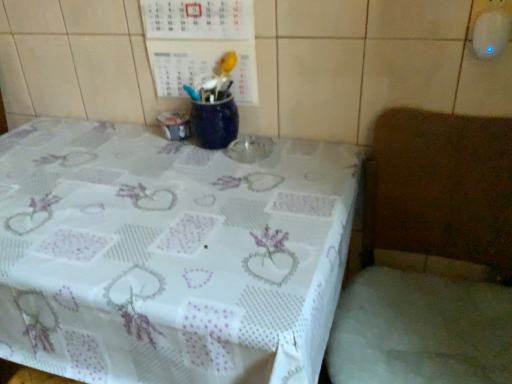
This screenshot has height=384, width=512. Find the location of `wooden chair at right`. wooden chair at right is located at coordinates tap(431, 256).

Describe the element at coordinates (420, 330) in the screenshot. I see `white lace tablecloth at lower right` at that location.

In order to face white lace tablecloth at lower right, should I rotate leftwards or rightwards?

A 21.931 degree turn to the right will do.

This screenshot has height=384, width=512. In order to click on wooden chair at right in this screenshot , I will do `click(431, 256)`.

Is wooden chair at right aimed at white lace tablecloth at center?

No, wooden chair at right does not turn towards white lace tablecloth at center.

How different are the orientations of wooden chair at right and white lace tablecloth at center in degrees?

0.288 degrees separate the facing orientations of wooden chair at right and white lace tablecloth at center.

Does point (375, 153) appear closer or farther from the camera than point (298, 187)?

Clearly, point (375, 153) is more distant from the camera than point (298, 187).

Considering the relative sizes of wooden chair at right and white lace tablecloth at center in the image provided, is wooden chair at right bigger than white lace tablecloth at center?

Actually, wooden chair at right might be smaller than white lace tablecloth at center.

Is there a large distance between white lace tablecloth at center and white lace tablecloth at lower right?

They are positioned close to each other.

Could you tell me if white lace tablecloth at center is turned towards white lace tablecloth at lower right?

No, white lace tablecloth at center does not turn towards white lace tablecloth at lower right.

From a real-world perspective, is white lace tablecloth at center on top of white lace tablecloth at lower right?

Incorrect, from a real-world perspective, white lace tablecloth at center is lower than white lace tablecloth at lower right.

Where is `table below the white lace tablecloth at lower right (from the image's perspective)`? The height and width of the screenshot is (384, 512). table below the white lace tablecloth at lower right (from the image's perspective) is located at coordinates (169, 255).

Between white lace tablecloth at center and wooden chair at right, which one is positioned in front?

wooden chair at right is closer to the camera.

Considering the positions of objects white lace tablecloth at center and wooden chair at right in the image provided, who is more to the left, white lace tablecloth at center or wooden chair at right?

Positioned to the left is white lace tablecloth at center.

Is white lace tablecloth at center not close to wooden chair at right?

They are positioned close to each other.

Which is behind, point (316, 197) or point (443, 262)?

The point (443, 262) is farther from the camera.

Locate an element on the screen. Image resolution: width=512 pixels, height=384 pixels. table lying in front of the white lace tablecloth at lower right is located at coordinates (169, 255).

Is white lace tablecloth at lower right taller than white lace tablecloth at center?

No.

Is white lace tablecloth at lower right oriented away from white lace tablecloth at center?

No, white lace tablecloth at center is not at the back of white lace tablecloth at lower right.

Would you consider white lace tablecloth at lower right to be distant from white lace tablecloth at center?

No, white lace tablecloth at lower right is in close proximity to white lace tablecloth at center.

Considering the relative sizes of white lace tablecloth at lower right and wooden chair at right in the image provided, is white lace tablecloth at lower right taller than wooden chair at right?

In fact, white lace tablecloth at lower right may be shorter than wooden chair at right.

Considering the positions of point (432, 343) and point (405, 187), is point (432, 343) closer or farther from the camera than point (405, 187)?

Clearly, point (432, 343) is closer to the camera than point (405, 187).

Does white lace tablecloth at lower right have a smaller size compared to wooden chair at right?

Indeed, white lace tablecloth at lower right has a smaller size compared to wooden chair at right.

From a real-world perspective, is white lace tablecloth at lower right physically below wooden chair at right?

Incorrect, from a real-world perspective, white lace tablecloth at lower right is higher than wooden chair at right.

Considering the relative positions of wooden chair at right and white lace tablecloth at lower right in the image provided, is wooden chair at right to the left or to the right of white lace tablecloth at lower right?

From the image, it's evident that wooden chair at right is to the right of white lace tablecloth at lower right.

Which is behind, point (425, 361) or point (429, 370)?

The point (425, 361) is more distant.

Considering the sizes of wooden chair at right and white lace tablecloth at lower right in the image, is wooden chair at right wider or thinner than white lace tablecloth at lower right?

Clearly, wooden chair at right has more width compared to white lace tablecloth at lower right.

From a real-world perspective, relative to white lace tablecloth at lower right, is wooden chair at right vertically above or below?

In terms of real-world spatial position, wooden chair at right is below white lace tablecloth at lower right.

Where is `chair that is on the right side of white lace tablecloth at center`? The image size is (512, 384). chair that is on the right side of white lace tablecloth at center is located at coordinates (431, 256).

I want to click on table that is under the white lace tablecloth at lower right (from a real-world perspective), so click(x=169, y=255).

Which object lies further to the anchor point white lace tablecloth at center, wooden chair at right or white lace tablecloth at lower right?

Based on the image, white lace tablecloth at lower right appears to be further to white lace tablecloth at center.

Considering their positions, is white lace tablecloth at center positioned closer to wooden chair at right than white lace tablecloth at lower right?

Based on the image, white lace tablecloth at lower right appears to be nearer to wooden chair at right.

When comparing their distances from white lace tablecloth at center, does white lace tablecloth at lower right or wooden chair at right seem closer?

Based on the image, wooden chair at right appears to be nearer to white lace tablecloth at center.

Which object lies nearer to the anchor point white lace tablecloth at lower right, white lace tablecloth at center or wooden chair at right?

wooden chair at right is positioned closer to the anchor white lace tablecloth at lower right.

Based on their spatial positions, is white lace tablecloth at lower right or white lace tablecloth at center closer to wooden chair at right?

white lace tablecloth at lower right is positioned closer to the anchor wooden chair at right.

From the image, which object appears to be farther from white lace tablecloth at lower right, wooden chair at right or white lace tablecloth at center?

white lace tablecloth at center is positioned further to the anchor white lace tablecloth at lower right.

This screenshot has width=512, height=384. I want to click on fabric situated between white lace tablecloth at center and wooden chair at right from left to right, so click(420, 330).